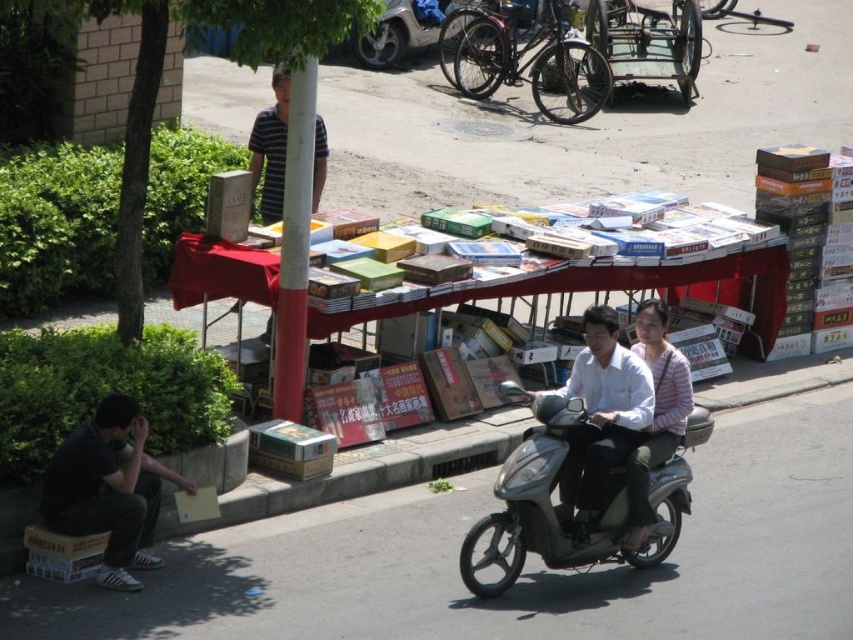
The height and width of the screenshot is (640, 853). I want to click on white glossy shirt at center, so click(x=601, y=410).

Is white glossy shirt at center closer to camera compared to metallic silver motorcycle at upper center?

Yes, white glossy shirt at center is in front of metallic silver motorcycle at upper center.

Between point (630, 516) and point (480, 35), which one is positioned in front?

Positioned in front is point (630, 516).

Where is `white glossy shirt at center`? The image size is (853, 640). white glossy shirt at center is located at coordinates [x=601, y=410].

What do you see at coordinates (575, 508) in the screenshot?
I see `metallic gray scooter at lower center` at bounding box center [575, 508].

Is metallic gray scooter at lower center positioned in front of matte white shirt at center?

Yes, metallic gray scooter at lower center is in front of matte white shirt at center.

Find the location of `metallic gray scooter at lower center`. metallic gray scooter at lower center is located at coordinates (575, 508).

Measure the distance from white glossy shirt at center to matte white shirt at center.

A distance of 20.31 centimeters exists between white glossy shirt at center and matte white shirt at center.

Is the position of white glossy shirt at center less distant than that of matte white shirt at center?

Yes, white glossy shirt at center is closer to the viewer.

Which is in front, point (625, 550) or point (660, 378)?

Point (625, 550) is in front.

The image size is (853, 640). I want to click on white glossy shirt at center, so click(601, 410).